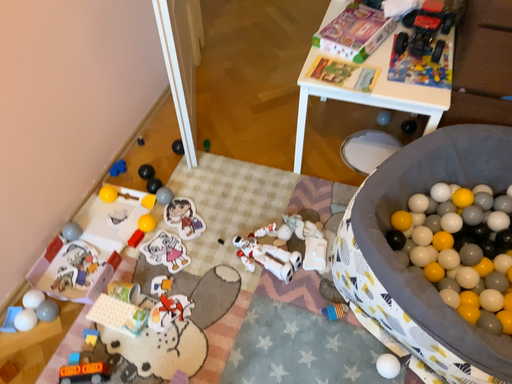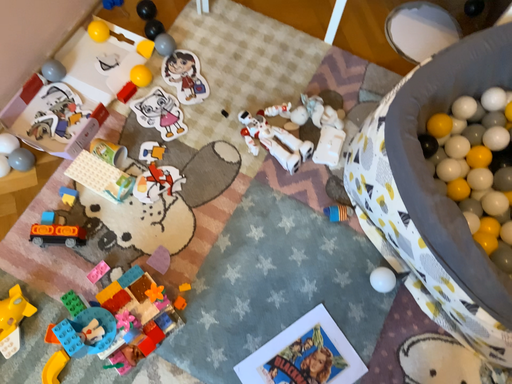
Question: How did the camera likely rotate when shooting the video?

Choices:
 (A) rotated upward
 (B) rotated downward

Answer: (B)